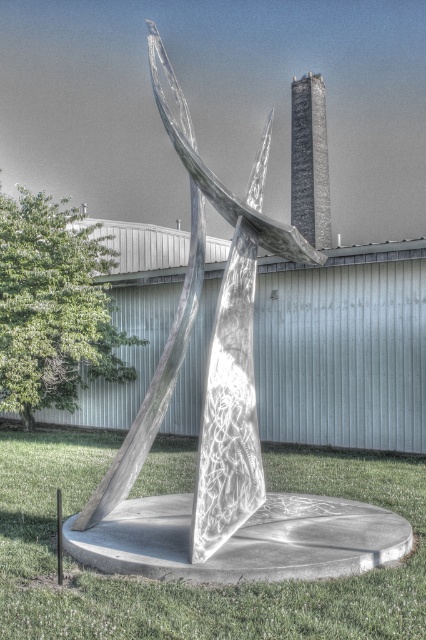
You are standing in front of the sculpture and want to place a small decorative rock exactly at the center of the green grass at center. According to the coordinates provided, where should you place the rock?

Place the small decorative rock at the coordinates point (196, 586) on the green grass at center.

You are planning to place a new bench in the grassy area where the green grass at center and shiny metallic sculpture at center are located. Since the bench requires a space wider than the sculpture, will the grassy area provide enough space for it?

The green grass at center has a larger width than the shiny metallic sculpture at center, so yes, the grassy area provides enough space for the bench that requires a wider space than the sculpture.

Looking at this image, you are a landscape architect designing a garden around the sculpture. You need to ensure that the green grass at center does not block the view of the shiny metallic sculpture at center. Based on their heights, is this possible?

The green grass at center is not as tall as the shiny metallic sculpture at center, so it will not block the view. The sculpture will remain visible above the grass.